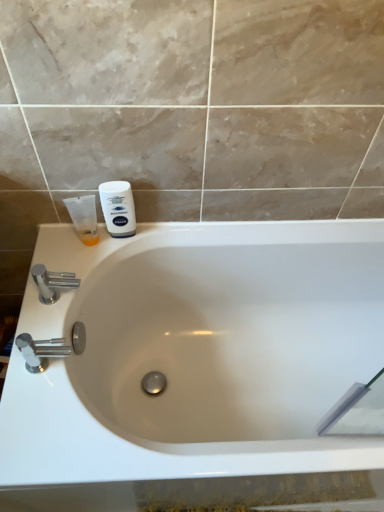
The width and height of the screenshot is (384, 512). I want to click on free point to the left of translucent orange tube at left, which is the 2th shaving cream from right to left, so click(x=59, y=244).